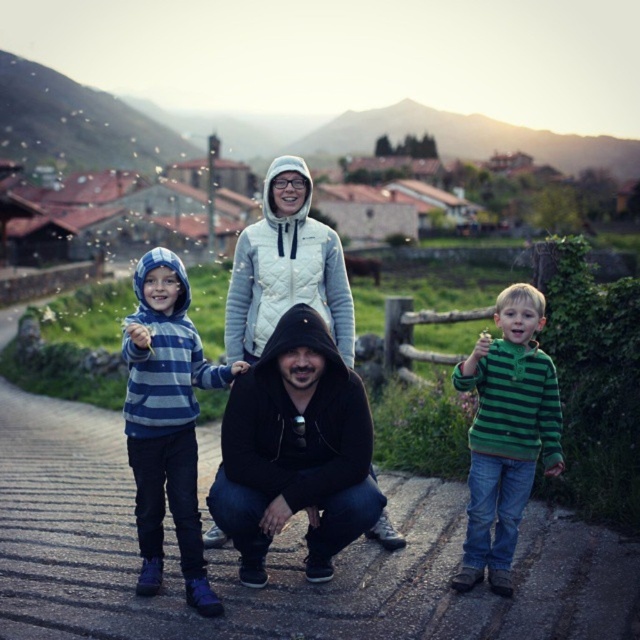
Question: Is black hoodie at center behind striped cotton hoodie at left?

Choices:
 (A) yes
 (B) no

Answer: (A)

Question: Which object is positioned farthest from the striped hoodie at center?

Choices:
 (A) striped cotton hoodie at left
 (B) dark asphalt road at center
 (C) white quilted jacket at upper center

Answer: (A)

Question: Considering the relative positions of green striped sweater at right and white quilted jacket at upper center in the image provided, where is green striped sweater at right located with respect to white quilted jacket at upper center?

Choices:
 (A) right
 (B) left

Answer: (A)

Question: Considering the relative positions of striped hoodie at center and striped cotton hoodie at left in the image provided, where is striped hoodie at center located with respect to striped cotton hoodie at left?

Choices:
 (A) above
 (B) below

Answer: (A)

Question: Which object is closer to the camera taking this photo?

Choices:
 (A) black hoodie at center
 (B) striped hoodie at center
 (C) striped cotton hoodie at left
 (D) green striped sweater at right

Answer: (C)

Question: Which object is the closest to the dark asphalt road at center?

Choices:
 (A) white quilted jacket at upper center
 (B) striped hoodie at center
 (C) green striped sweater at right
 (D) black hoodie at center

Answer: (D)